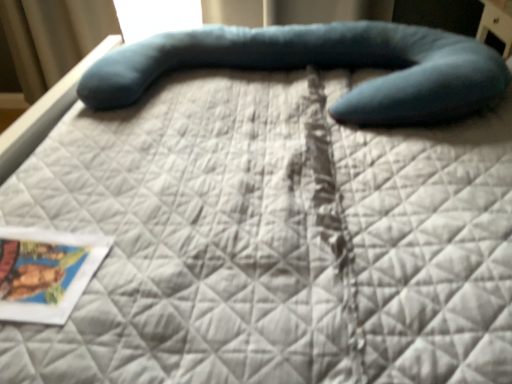
What do you see at coordinates (45, 272) in the screenshot?
I see `matte paper postcard at lower left` at bounding box center [45, 272].

Locate an element on the screen. matte paper postcard at lower left is located at coordinates (45, 272).

What is the approximate height of matte paper postcard at lower left?

matte paper postcard at lower left is 0.62 inches tall.

What do you see at coordinates (322, 67) in the screenshot? I see `teal fabric bean bag chair at center` at bounding box center [322, 67].

What are the coordinates of `teal fabric bean bag chair at center` in the screenshot? It's located at (322, 67).

Where is `matte paper postcard at lower left`? matte paper postcard at lower left is located at coordinates (45, 272).

Can you confirm if matte paper postcard at lower left is positioned to the left of teal fabric bean bag chair at center?

Correct, you'll find matte paper postcard at lower left to the left of teal fabric bean bag chair at center.

Considering the positions of objects matte paper postcard at lower left and teal fabric bean bag chair at center in the image provided, who is in front, matte paper postcard at lower left or teal fabric bean bag chair at center?

matte paper postcard at lower left is in front.

Does point (20, 272) come in front of point (395, 91)?

That is True.

From the image's perspective, does matte paper postcard at lower left appear higher than teal fabric bean bag chair at center?

No, from the image's perspective, matte paper postcard at lower left is not above teal fabric bean bag chair at center.

From a real-world perspective, who is located lower, matte paper postcard at lower left or teal fabric bean bag chair at center?

matte paper postcard at lower left is physically lower.

In terms of width, does matte paper postcard at lower left look wider or thinner when compared to teal fabric bean bag chair at center?

Clearly, matte paper postcard at lower left has less width compared to teal fabric bean bag chair at center.

Considering the sizes of objects matte paper postcard at lower left and teal fabric bean bag chair at center in the image provided, who is shorter, matte paper postcard at lower left or teal fabric bean bag chair at center?

Standing shorter between the two is matte paper postcard at lower left.

Considering the sizes of matte paper postcard at lower left and teal fabric bean bag chair at center in the image, is matte paper postcard at lower left bigger or smaller than teal fabric bean bag chair at center?

In the image, matte paper postcard at lower left appears to be smaller than teal fabric bean bag chair at center.

Is teal fabric bean bag chair at center completely or partially inside matte paper postcard at lower left?

No, matte paper postcard at lower left does not contain teal fabric bean bag chair at center.

Is matte paper postcard at lower left next to teal fabric bean bag chair at center?

No, matte paper postcard at lower left is not making contact with teal fabric bean bag chair at center.

Consider the image. Does matte paper postcard at lower left turn towards teal fabric bean bag chair at center?

No, matte paper postcard at lower left does not turn towards teal fabric bean bag chair at center.

Can you tell me how much matte paper postcard at lower left and teal fabric bean bag chair at center differ in facing direction?

3.68 degrees separate the facing orientations of matte paper postcard at lower left and teal fabric bean bag chair at center.

Locate an element on the screen. The height and width of the screenshot is (384, 512). postcard below the teal fabric bean bag chair at center (from a real-world perspective) is located at coordinates (45, 272).

Is teal fabric bean bag chair at center to the left of matte paper postcard at lower left from the viewer's perspective?

Incorrect, teal fabric bean bag chair at center is not on the left side of matte paper postcard at lower left.

Which object is more forward, teal fabric bean bag chair at center or matte paper postcard at lower left?

matte paper postcard at lower left is more forward.

Which is in front, point (482, 92) or point (88, 250)?

Point (88, 250)

From the picture: From the image's perspective, is teal fabric bean bag chair at center under matte paper postcard at lower left?

No, from the image's perspective, teal fabric bean bag chair at center is not beneath matte paper postcard at lower left.

From a real-world perspective, is teal fabric bean bag chair at center physically located above or below matte paper postcard at lower left?

From a real-world perspective, teal fabric bean bag chair at center is physically above matte paper postcard at lower left.

Can you confirm if teal fabric bean bag chair at center is wider than matte paper postcard at lower left?

Yes.

Considering the sizes of objects teal fabric bean bag chair at center and matte paper postcard at lower left in the image provided, who is taller, teal fabric bean bag chair at center or matte paper postcard at lower left?

With more height is teal fabric bean bag chair at center.

Considering the sizes of objects teal fabric bean bag chair at center and matte paper postcard at lower left in the image provided, who is smaller, teal fabric bean bag chair at center or matte paper postcard at lower left?

With smaller size is matte paper postcard at lower left.

Is matte paper postcard at lower left surrounded by teal fabric bean bag chair at center?

Actually, matte paper postcard at lower left is outside teal fabric bean bag chair at center.

Is teal fabric bean bag chair at center not close to matte paper postcard at lower left?

No, there isn't a large distance between teal fabric bean bag chair at center and matte paper postcard at lower left.

Is teal fabric bean bag chair at center oriented towards matte paper postcard at lower left?

No.

How far apart are teal fabric bean bag chair at center and matte paper postcard at lower left?

83.81 centimeters.

At what (x,y) coordinates should I click in order to perform the action: click on bean bag chair that appears above the matte paper postcard at lower left (from a real-world perspective). Please return your answer as a coordinate pair (x, y). Looking at the image, I should click on (322, 67).

You are a GUI agent. You are given a task and a screenshot of the screen. Output one action in this format:
    pyautogui.click(x=<x>, y=<y>)
    Task: Click on the bean bag chair to the right of matte paper postcard at lower left
    The height and width of the screenshot is (384, 512).
    Given the screenshot: What is the action you would take?
    pyautogui.click(x=322, y=67)

Locate an element on the screen. This screenshot has width=512, height=384. postcard below the teal fabric bean bag chair at center (from the image's perspective) is located at coordinates (45, 272).